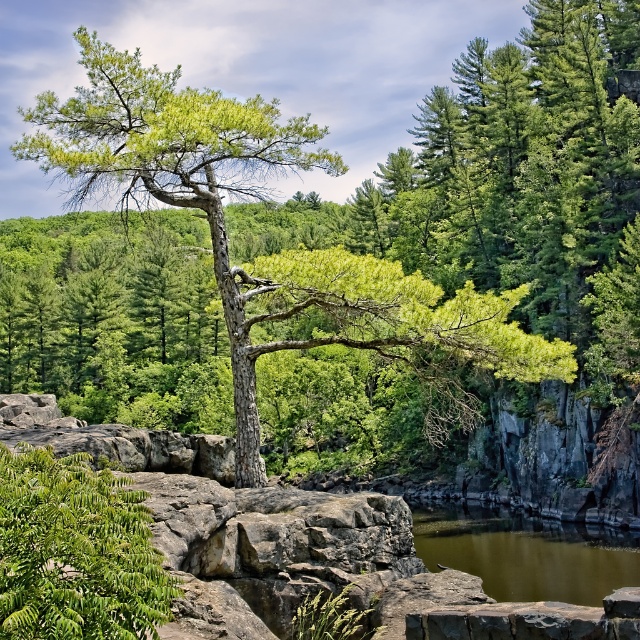
Does point (186, 147) lie in front of point (620, 561)?

Yes, point (186, 147) is closer to viewer.

Is point (84, 67) positioned after point (545, 532)?

No, it is not.

Image resolution: width=640 pixels, height=640 pixels. What are the coordinates of `green textured tree at center` in the screenshot? It's located at (196, 192).

Identify the location of green textured tree at center. (196, 192).